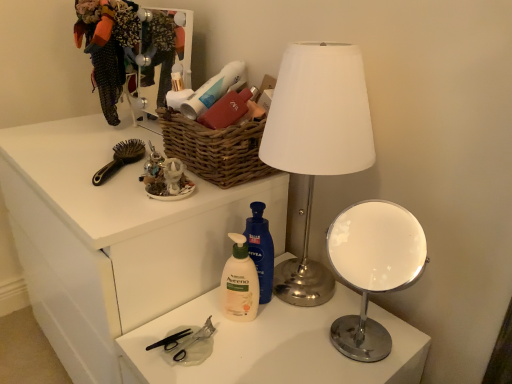
Find the location of a particular element. free space in front of white matte lotion at center, which is counted as the first cleaning product, starting from the left is located at coordinates (239, 359).